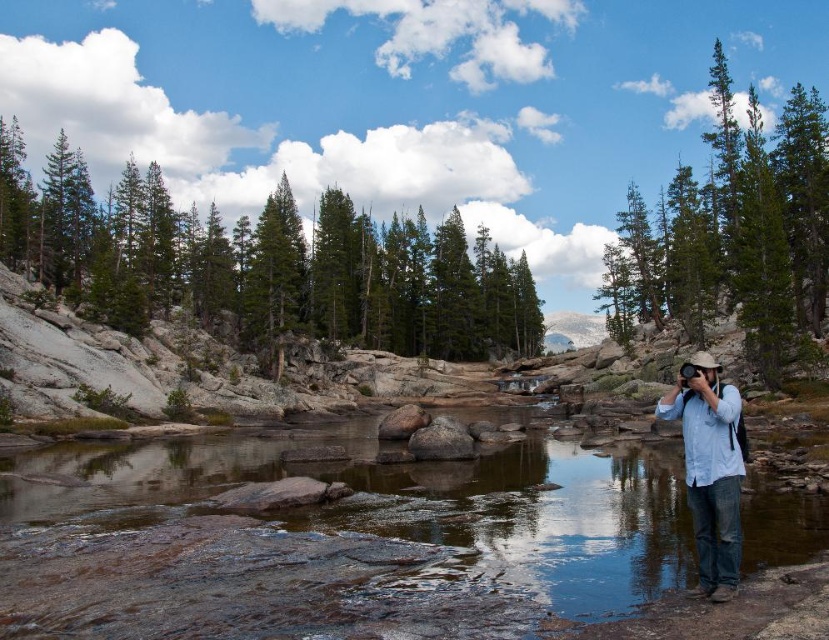
You are standing at the center of the riverbed and want to take a photo of the green matte tree at upper right. In which direction should you point your camera to capture the tree in the frame?

The green matte tree at upper right is located at the upper right position, so you should point your camera towards the upper right direction to capture it in the frame.